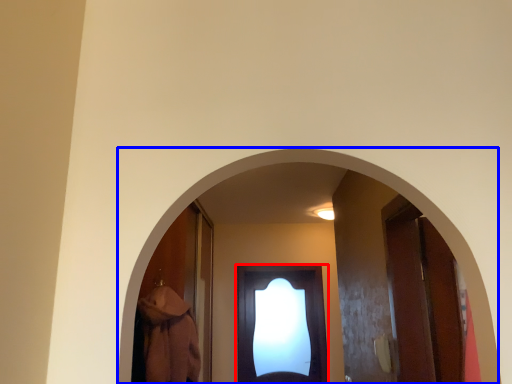
Question: Which object appears farthest to the camera in this image, door (highlighted by a red box) or archway (highlighted by a blue box)?

Choices:
 (A) door
 (B) archway

Answer: (A)